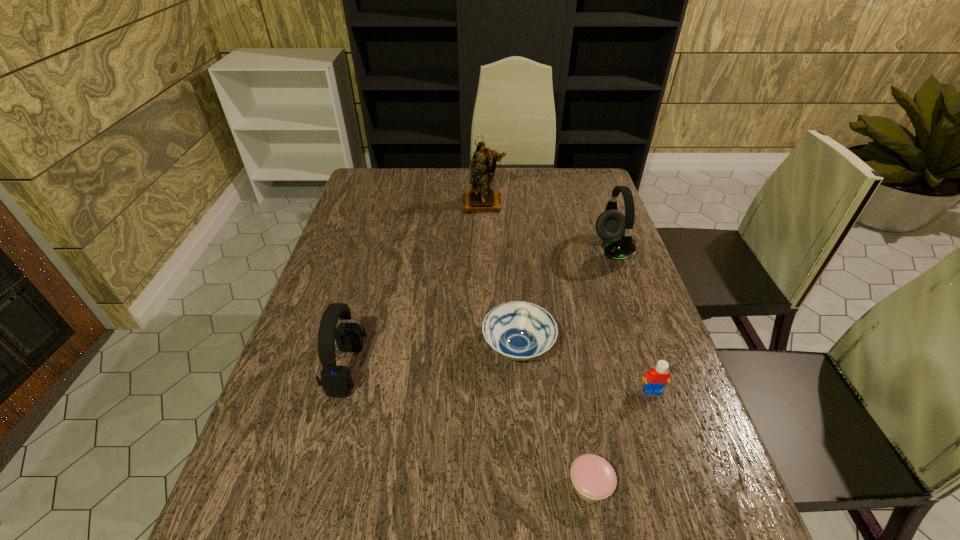
The height and width of the screenshot is (540, 960). What are the coordinates of `headset located at the right edge` in the screenshot? It's located at (611, 225).

Locate an element on the screen. Image resolution: width=960 pixels, height=540 pixels. Lego present at the right edge is located at coordinates (655, 379).

This screenshot has width=960, height=540. In the image, there is a desktop. Find the location of `vacant space at the far edge`. vacant space at the far edge is located at coordinates (509, 193).

In the image, there is a desktop. At what (x,y) coordinates should I click in order to perform the action: click on vacant space at the left edge. Please return your answer as a coordinate pair (x, y). Looking at the image, I should click on (330, 399).

The width and height of the screenshot is (960, 540). I want to click on free space at the right edge of the desktop, so click(611, 295).

Where is `vacant space that is in between the fifth nearest object and the third shortest object`? This screenshot has width=960, height=540. vacant space that is in between the fifth nearest object and the third shortest object is located at coordinates (632, 319).

At what (x,y) coordinates should I click in order to perform the action: click on empty space between the farther headset and the soup bowl. Please return your answer as a coordinate pair (x, y). This screenshot has width=960, height=540. Looking at the image, I should click on (564, 299).

I want to click on free spot between the third shortest object and the soup bowl, so click(585, 370).

Find the location of a particular element. The image size is (960, 540). free space that is in between the shortest object and the fifth nearest object is located at coordinates (601, 367).

Locate an element on the screen. free space between the figurine and the Lego is located at coordinates (568, 296).